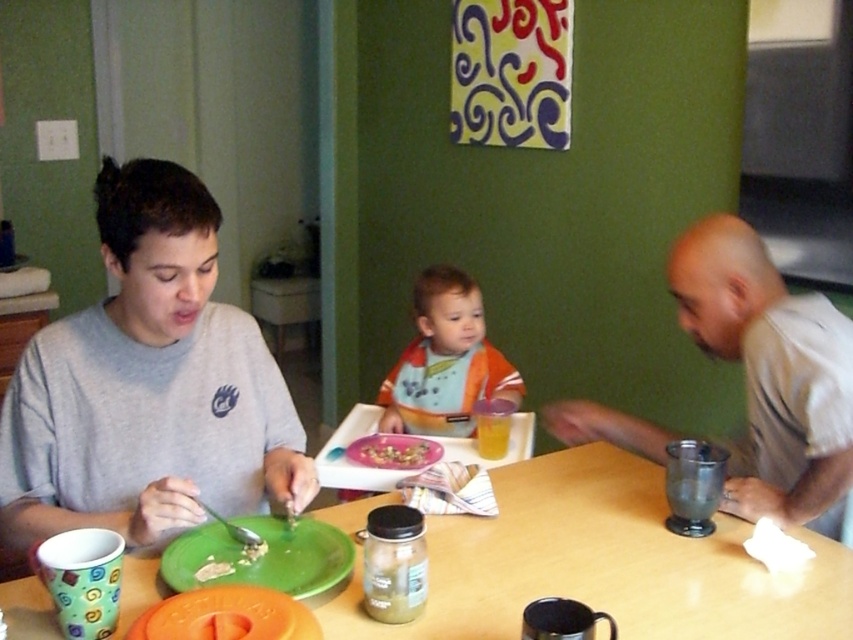
You are a guest at this family meal and want to reach for the metallic silver cup at right without disturbing the gray matte shirt at left. Is the cup within easy reach from your current position?

The metallic silver cup at right is to the right of the gray matte shirt at left, so it should be within easy reach if you move your arm towards the right side of the frame.

You are a guest at this family meal. You want to place your metallic silver cup at right on the wooden table at center. Is the cup currently positioned in a way that allows you to easily move it to the table?

The wooden table at center is in front of the metallic silver cup at right, meaning the cup is behind the table from your perspective. To move the cup to the table, you would need to reach behind the table, which might be challenging depending on the arrangement. Consider checking if there is space around the table to access the cup more easily.

You are a guest at this family meal. You need to place a 12cm wide decorative item on the table. Which object from the gray matte shirt at left and metallic silver cup at right can you place it next to without overlapping?

The metallic silver cup at right has a smaller width than the gray matte shirt at left. Since the decorative item is 12cm wide, placing it next to the metallic silver cup at right would require less space, so it can fit without overlapping.